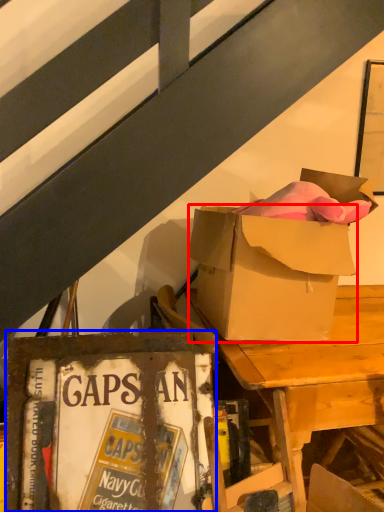
Question: Among these objects, which one is farthest to the camera, box (highlighted by a red box) or paperback book (highlighted by a blue box)?

Choices:
 (A) box
 (B) paperback book

Answer: (A)